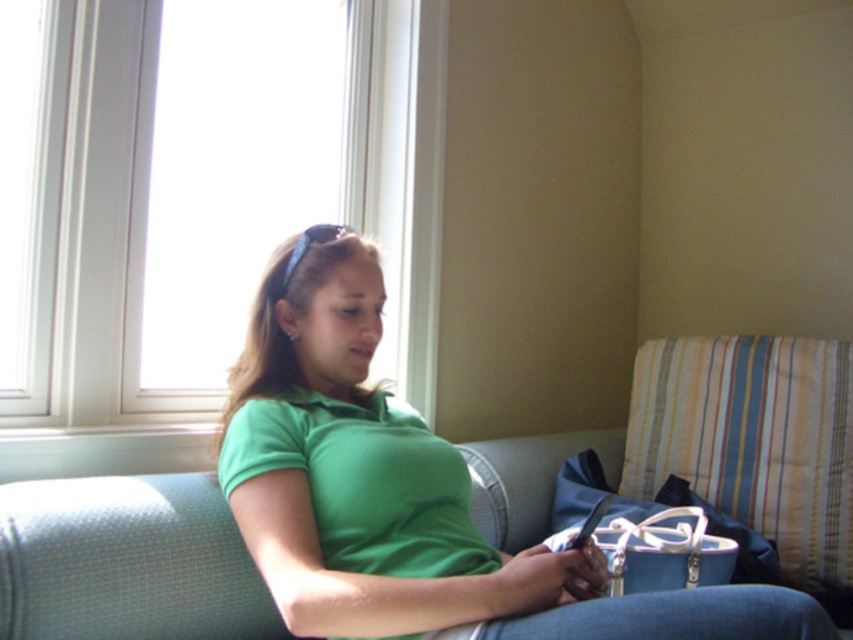
Question: Which object is farther from the camera taking this photo?

Choices:
 (A) striped fabric pillow at right
 (B) green matte shirt at center

Answer: (A)

Question: Does white plastic window at upper left appear on the right side of striped fabric pillow at right?

Choices:
 (A) no
 (B) yes

Answer: (A)

Question: Is white plastic window at upper left further to the viewer compared to striped fabric pillow at right?

Choices:
 (A) yes
 (B) no

Answer: (B)

Question: Which object is farther from the camera taking this photo?

Choices:
 (A) white plastic window at upper left
 (B) striped fabric pillow at right

Answer: (B)

Question: Is white plastic window at upper left wider than striped fabric pillow at right?

Choices:
 (A) yes
 (B) no

Answer: (A)

Question: Which object is positioned closest to the white plastic window at upper left?

Choices:
 (A) striped fabric pillow at right
 (B) green matte shirt at center

Answer: (B)